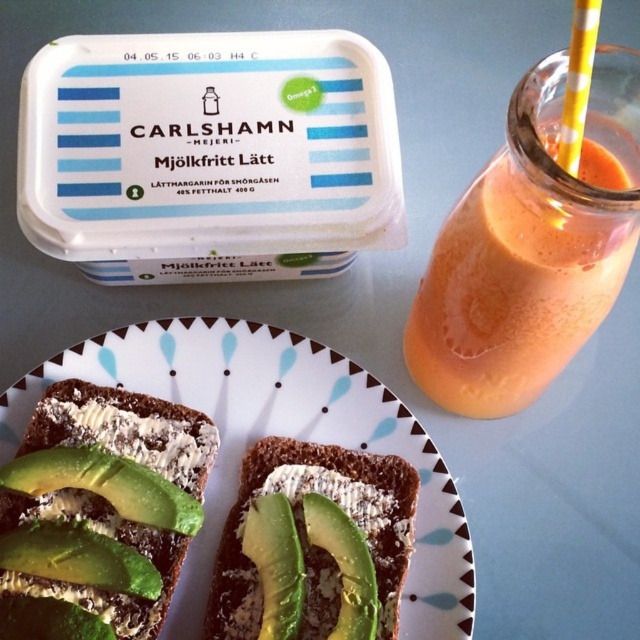
Is orange smoothie at upper right smaller than green avocado toast at lower center?

Incorrect, orange smoothie at upper right is not smaller in size than green avocado toast at lower center.

In order to click on orange smoothie at upper right in this screenshot , I will do `click(512, 291)`.

Who is more distant from viewer, (435, 388) or (406, 472)?

The point (435, 388) is more distant.

Where is `orange smoothie at upper right`? This screenshot has height=640, width=640. orange smoothie at upper right is located at coordinates (512, 291).

Can you confirm if white ceramic plate at center is thinner than green avocado toast at lower center?

Incorrect, white ceramic plate at center's width is not less than green avocado toast at lower center's.

Does white ceramic plate at center appear under green avocado toast at lower center?

No, white ceramic plate at center is not below green avocado toast at lower center.

You are a GUI agent. You are given a task and a screenshot of the screen. Output one action in this format:
    pyautogui.click(x=<x>, y=<y>)
    Task: Click on the white ceramic plate at center
    
    Given the screenshot: What is the action you would take?
    pyautogui.click(x=272, y=435)

Does white ceramic plate at center have a greater height compared to green avocado toast at center?

Yes, white ceramic plate at center is taller than green avocado toast at center.

Who is positioned more to the left, white ceramic plate at center or green avocado toast at center?

green avocado toast at center is more to the left.

Find the location of `white ceramic plate at center`. white ceramic plate at center is located at coordinates (272, 435).

Locate an element on the screen. white ceramic plate at center is located at coordinates (272, 435).